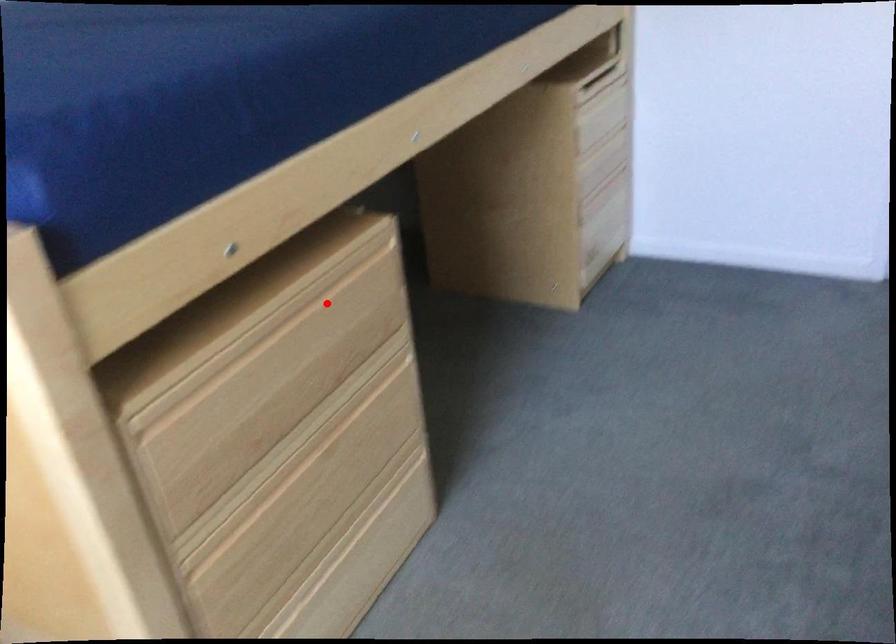
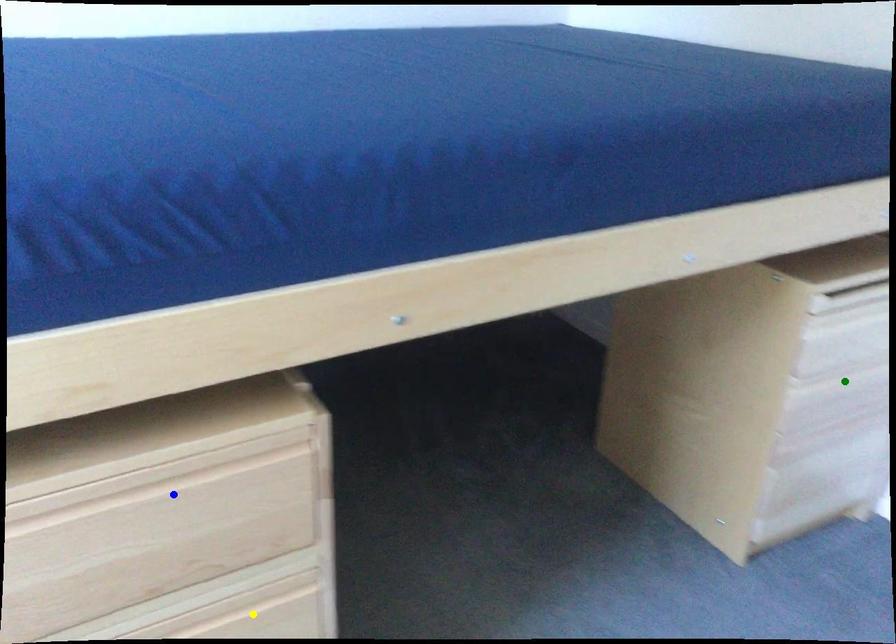
Question: I am providing you with two images of the same scene from different viewpoints. A red point is marked on the first image. You are given multiple points on the second image. Which mark in image 2 goes with the point in image 1?

Choices:
 (A) green point
 (B) yellow point
 (C) blue point

Answer: (C)